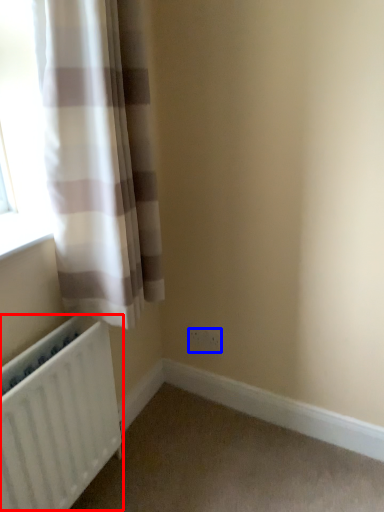
Question: Among these objects, which one is farthest to the camera, radiator (highlighted by a red box) or electric outlet (highlighted by a blue box)?

Choices:
 (A) radiator
 (B) electric outlet

Answer: (B)